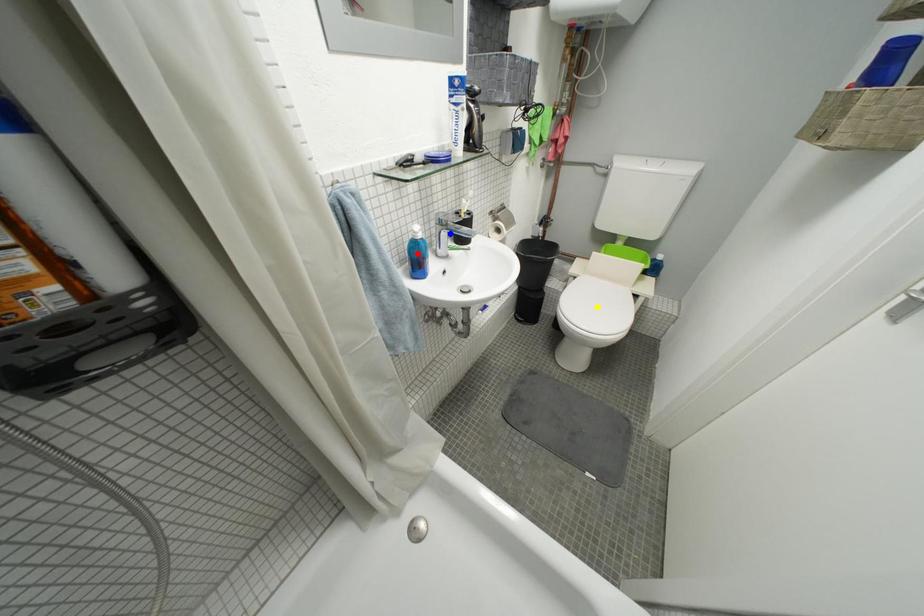
Order these from nearest to farthest:
blue point, red point, yellow point

yellow point < blue point < red point